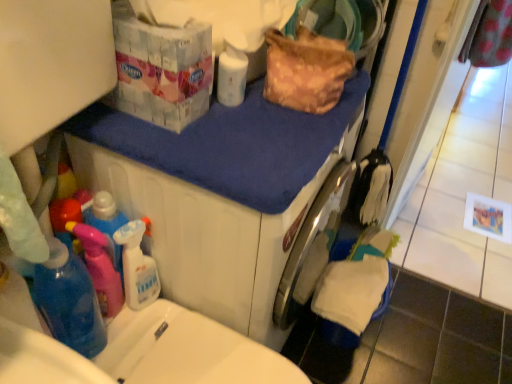
What do you see at coordinates (231, 76) in the screenshot?
I see `white glossy bottle at upper center` at bounding box center [231, 76].

The width and height of the screenshot is (512, 384). I want to click on white glossy bottle at upper center, so click(x=231, y=76).

Identify the location of blue fabric at upper center. (231, 144).

What do you see at coordinates (231, 144) in the screenshot?
I see `blue fabric at upper center` at bounding box center [231, 144].

Locate an element on the screen. Image resolution: width=512 pixels, height=384 pixels. white glossy bottle at upper center is located at coordinates tap(231, 76).

Does white glossy bottle at upper center appear on the right side of blue fabric at upper center?

Incorrect, white glossy bottle at upper center is not on the right side of blue fabric at upper center.

Is white glossy bottle at upper center further to camera compared to blue fabric at upper center?

Yes, it is.

Considering the positions of point (243, 80) and point (137, 151), is point (243, 80) closer or farther from the camera than point (137, 151)?

Clearly, point (243, 80) is more distant from the camera than point (137, 151).

From the image's perspective, does white glossy bottle at upper center appear higher than blue fabric at upper center?

Indeed, from the image's perspective, white glossy bottle at upper center is shown above blue fabric at upper center.

From a real-world perspective, is white glossy bottle at upper center physically located above or below blue fabric at upper center?

white glossy bottle at upper center is situated higher than blue fabric at upper center in the real world.

Which object is wider, white glossy bottle at upper center or blue fabric at upper center?

With larger width is blue fabric at upper center.

In terms of height, does white glossy bottle at upper center look taller or shorter compared to blue fabric at upper center?

In the image, white glossy bottle at upper center appears to be taller than blue fabric at upper center.

Is white glossy bottle at upper center bigger than blue fabric at upper center?

No.

Is white glossy bottle at upper center inside the boundaries of blue fabric at upper center, or outside?

white glossy bottle at upper center lies outside blue fabric at upper center.

Is white glossy bottle at upper center positioned far away from blue fabric at upper center?

No, white glossy bottle at upper center is not far away from blue fabric at upper center.

Is white glossy bottle at upper center facing away from blue fabric at upper center?

No, white glossy bottle at upper center's orientation is not away from blue fabric at upper center.

What's the angular difference between white glossy bottle at upper center and blue fabric at upper center's facing directions?

0.247 degrees separate the facing orientations of white glossy bottle at upper center and blue fabric at upper center.

Image resolution: width=512 pixels, height=384 pixels. Identify the location of cleaning product behind the blue fabric at upper center. (231, 76).

Can you confirm if blue fabric at upper center is positioned to the right of white glossy bottle at upper center?

Yes, blue fabric at upper center is to the right of white glossy bottle at upper center.

Is the depth of blue fabric at upper center greater than that of white glossy bottle at upper center?

No, it is in front of white glossy bottle at upper center.

Considering the positions of point (127, 117) and point (227, 78), is point (127, 117) closer or farther from the camera than point (227, 78)?

Point (127, 117) appears to be closer to the viewer than point (227, 78).

From the image's perspective, is blue fabric at upper center above white glossy bottle at upper center?

No, from the image's perspective, blue fabric at upper center is not on top of white glossy bottle at upper center.

From a real-world perspective, which is physically above, blue fabric at upper center or white glossy bottle at upper center?

From a 3D spatial view, white glossy bottle at upper center is above.

Considering the sizes of objects blue fabric at upper center and white glossy bottle at upper center in the image provided, who is wider, blue fabric at upper center or white glossy bottle at upper center?

Wider between the two is blue fabric at upper center.

Is blue fabric at upper center taller or shorter than white glossy bottle at upper center?

blue fabric at upper center is shorter than white glossy bottle at upper center.

Does blue fabric at upper center have a larger size compared to white glossy bottle at upper center?

Indeed, blue fabric at upper center has a larger size compared to white glossy bottle at upper center.

Is blue fabric at upper center located outside white glossy bottle at upper center?

Yes, blue fabric at upper center is not within white glossy bottle at upper center.

Based on the photo, is blue fabric at upper center far away from white glossy bottle at upper center?

blue fabric at upper center is actually quite close to white glossy bottle at upper center.

Is blue fabric at upper center facing away from white glossy bottle at upper center?

No, blue fabric at upper center's orientation is not away from white glossy bottle at upper center.

Where is `cleaning product above the blue fabric at upper center (from a real-world perspective)`? cleaning product above the blue fabric at upper center (from a real-world perspective) is located at coordinates (231, 76).

The image size is (512, 384). I want to click on counter top to the right of white glossy bottle at upper center, so click(x=231, y=144).

Locate an element on the screen. This screenshot has height=384, width=512. cleaning product above the blue fabric at upper center (from a real-world perspective) is located at coordinates (231, 76).